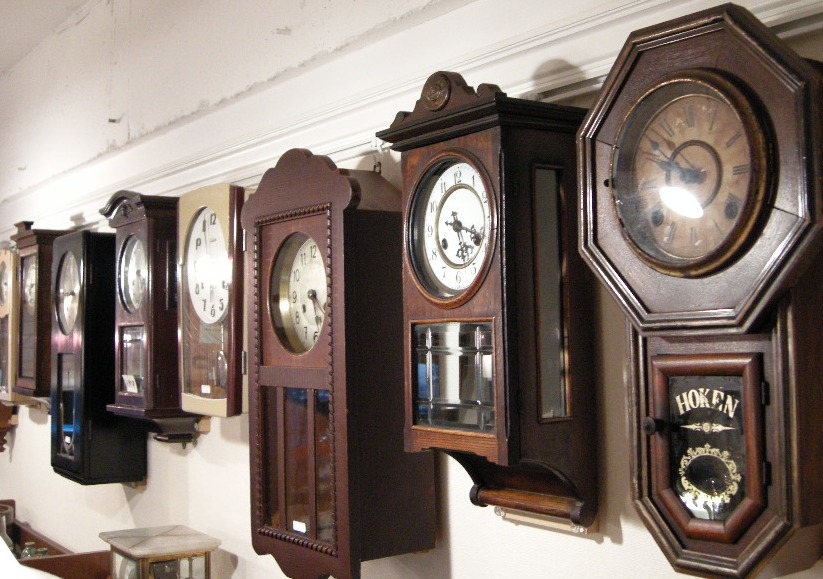
Find the location of a particular element. The image size is (823, 579). clock is located at coordinates (10, 283), (31, 263), (76, 277), (135, 277), (229, 269), (300, 284), (468, 263), (649, 192).